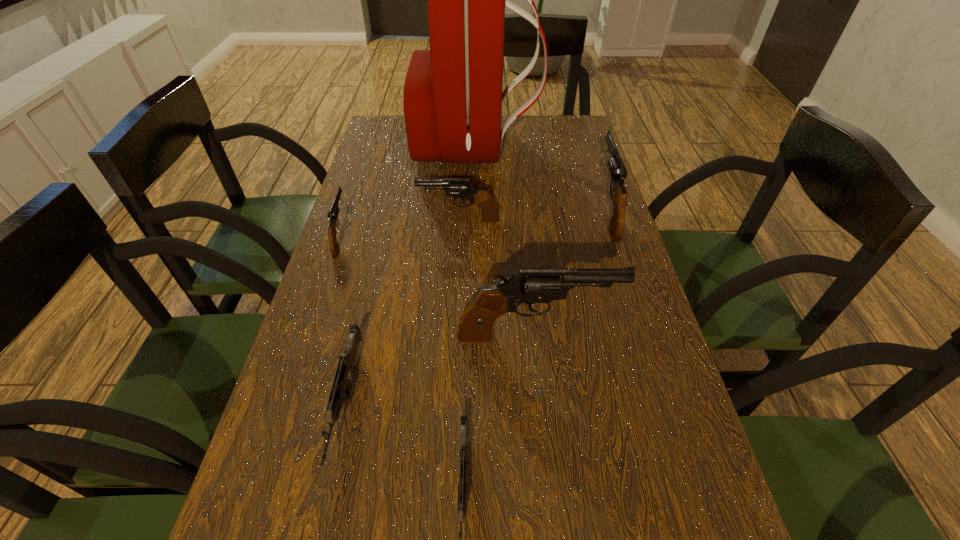
Where is `vacant area between the biggest black gun and the pink backpack`? The image size is (960, 540). vacant area between the biggest black gun and the pink backpack is located at coordinates (505, 242).

Where is `free space between the second object from left to right and the tallest object`? free space between the second object from left to right and the tallest object is located at coordinates click(411, 274).

At what (x,y) coordinates should I click in order to perform the action: click on unoccupied area between the smallest black gun and the backpack. Please return your answer as a coordinate pair (x, y). The height and width of the screenshot is (540, 960). Looking at the image, I should click on (408, 192).

At what (x,y) coordinates should I click in order to perform the action: click on free space between the tallest object and the second tallest gun. Please return your answer as a coordinate pair (x, y). The image size is (960, 540). Looking at the image, I should click on (541, 179).

Locate an element on the screen. This screenshot has height=540, width=960. free spot between the fourth tallest object and the nearest black gun is located at coordinates (497, 278).

I want to click on free space between the second shortest object and the tallest object, so click(x=411, y=274).

Identify the location of object that can be found as the third closest to the third shortest gun. (347, 363).

Locate an element on the screen. The image size is (960, 540). the third closest object to the third tallest gun is located at coordinates (618, 171).

Image resolution: width=960 pixels, height=540 pixels. In order to click on the second closest gun to the leftmost object in this screenshot , I will do `click(347, 363)`.

This screenshot has width=960, height=540. I want to click on gun that stands as the second closest to the bigger grey gun, so click(x=462, y=486).